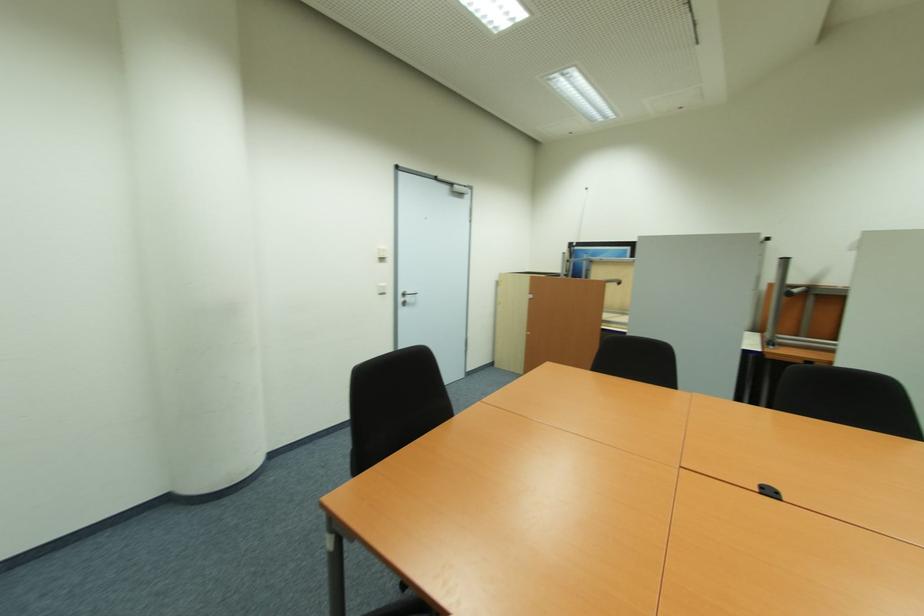
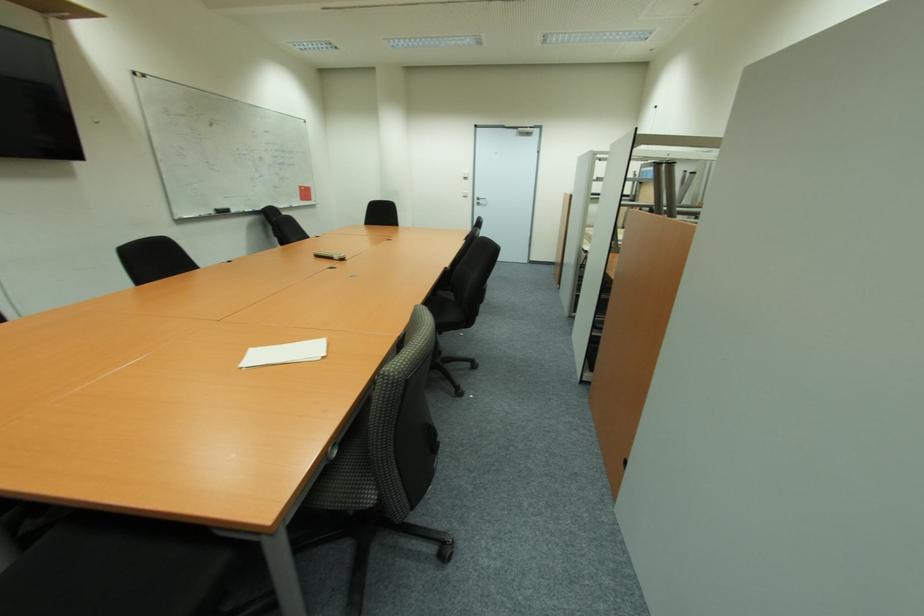
The point at (410, 300) is marked in the first image. Where is the corresponding point in the second image?

(483, 203)